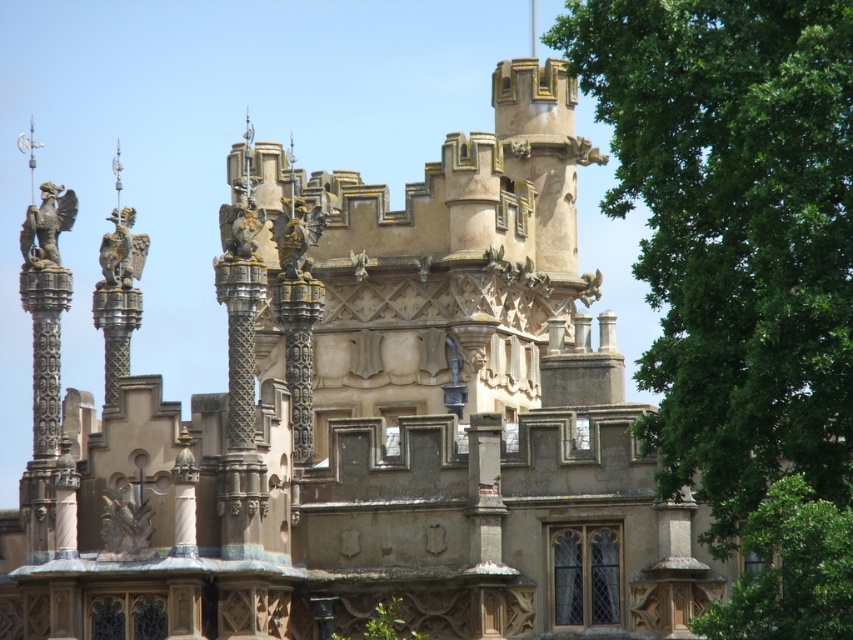
You are standing at the base of the grand medieval building and looking up at the roofline. There are several tall, slender columns with statues on top. You notice a point marked at coordinates [788,570]. What object does this point correspond to?

The point at coordinates [788,570] corresponds to the green leafy tree at lower right.

You are an architect inspecting the roofline of this medieval building. You notice two statues on the roofline, the polished bronze eagle at left and the polished bronze statue at center. Which one is smaller in size?

The polished bronze eagle at left is smaller in size compared to the polished bronze statue at center.